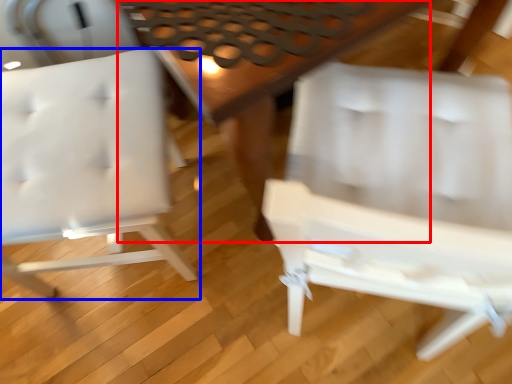
Question: Which point is further to the camera, table (highlighted by a red box) or chair (highlighted by a blue box)?

Choices:
 (A) table
 (B) chair

Answer: (A)